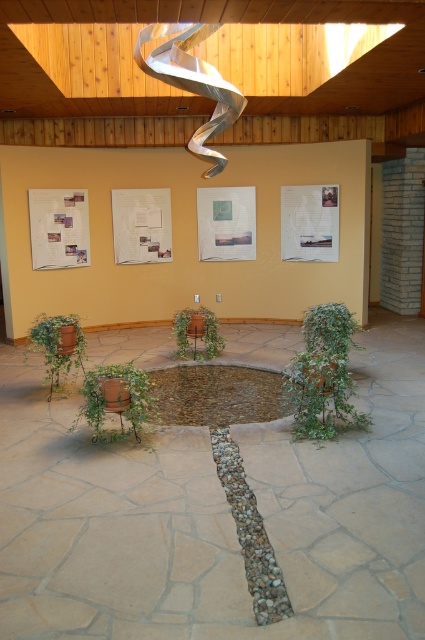
Question: Does green matte pot at lower left have a larger size compared to green matte plant at center?

Choices:
 (A) yes
 (B) no

Answer: (A)

Question: Which point appears farthest from the camera in this image?

Choices:
 (A) (127, 401)
 (B) (312, 429)
 (C) (70, 352)

Answer: (C)

Question: Which of the following is the farthest from the observer?

Choices:
 (A) (119, 408)
 (B) (322, 349)
 (C) (190, 328)

Answer: (C)

Question: Is green matte pot at center thinner than green matte pot at lower left?

Choices:
 (A) yes
 (B) no

Answer: (B)

Question: Is green matte pot at lower left further to the viewer compared to green matte plant at center?

Choices:
 (A) no
 (B) yes

Answer: (A)

Question: Considering the real-world distances, which object is farthest from the green leafy plant at center?

Choices:
 (A) green matte plant at center
 (B) green matte pot at center
 (C) green matte pot at lower left

Answer: (C)